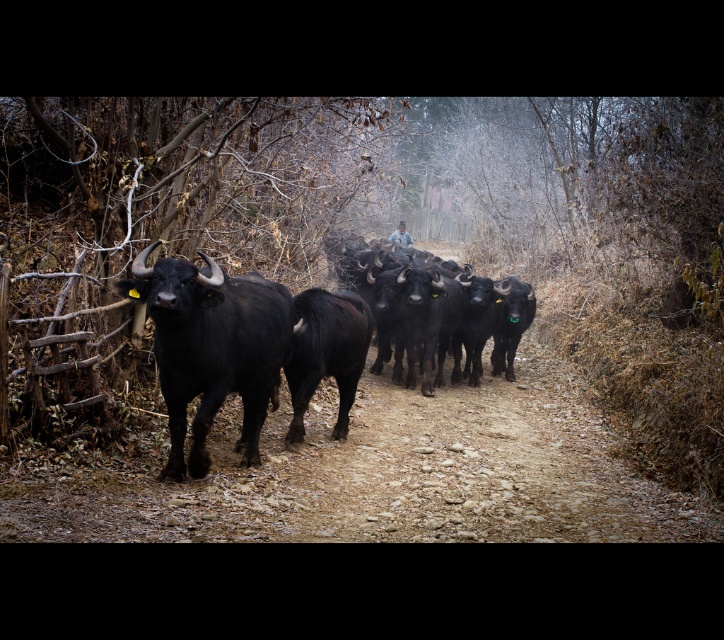
Question: Does black glossy buffalo at center have a larger size compared to black shaggy bull at center?

Choices:
 (A) yes
 (B) no

Answer: (A)

Question: Which point appears farthest from the camera in this image?

Choices:
 (A) (248, 413)
 (B) (358, 307)
 (C) (324, 364)

Answer: (B)

Question: Which object is closer to the camera taking this photo?

Choices:
 (A) shiny black bull at center
 (B) black shaggy bull at center
 (C) black glossy buffalo at center

Answer: (A)

Question: Does black glossy buffalo at center appear under shiny black bull at center?

Choices:
 (A) yes
 (B) no

Answer: (A)

Question: Can you confirm if black glossy buffalo at center is thinner than black shaggy bull at center?

Choices:
 (A) no
 (B) yes

Answer: (A)

Question: Which of the following is the closest to the observer?

Choices:
 (A) shiny black bull at center
 (B) black glossy buffalo at center

Answer: (A)